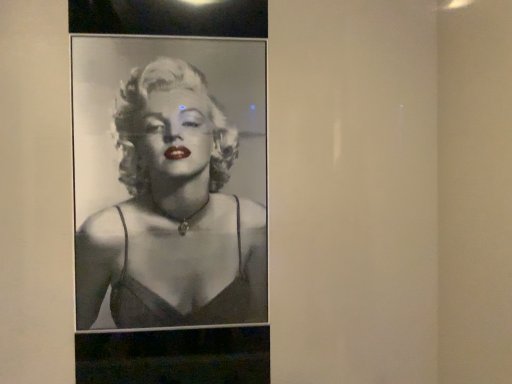
Describe the element at coordinates (173, 214) in the screenshot. I see `matte black dress at center` at that location.

In order to click on matte black dress at center in this screenshot , I will do `click(173, 214)`.

Locate an element on the screen. This screenshot has height=384, width=512. matte black dress at center is located at coordinates (173, 214).